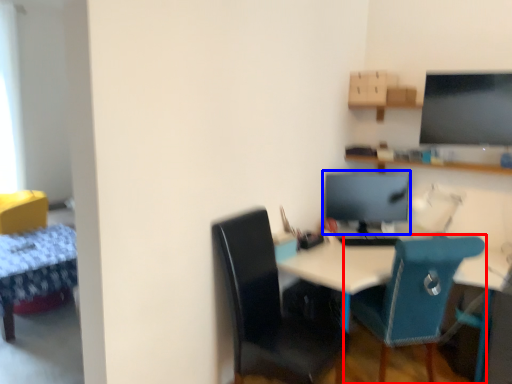
Question: Which object appears farthest to the camera in this image, chair (highlighted by a red box) or computer monitor (highlighted by a blue box)?

Choices:
 (A) chair
 (B) computer monitor

Answer: (B)